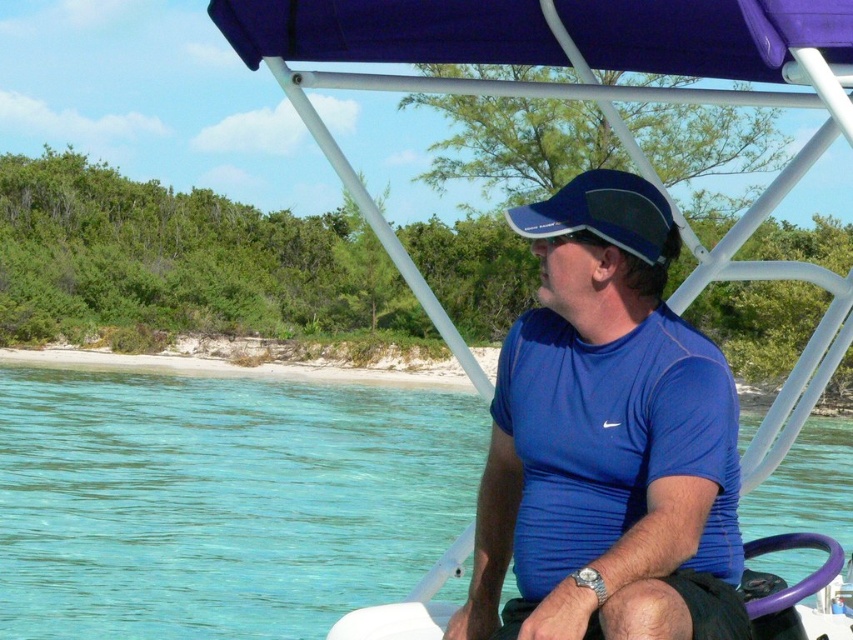
Question: Which object appears closest to the camera in this image?

Choices:
 (A) blue mesh baseball cap at center
 (B) blue mesh shirt at center
 (C) clear blue water at center

Answer: (B)

Question: Is clear blue water at center positioned behind blue mesh baseball cap at center?

Choices:
 (A) no
 (B) yes

Answer: (B)

Question: Observing the image, what is the correct spatial positioning of clear blue water at center in reference to blue mesh shirt at center?

Choices:
 (A) left
 (B) right

Answer: (B)

Question: Can you confirm if clear blue water at center is bigger than blue mesh baseball cap at center?

Choices:
 (A) yes
 (B) no

Answer: (A)

Question: Which object appears closest to the camera in this image?

Choices:
 (A) blue mesh baseball cap at center
 (B) clear blue water at center
 (C) blue mesh shirt at center

Answer: (C)

Question: Among these points, which one is nearest to the camera?

Choices:
 (A) (657, 209)
 (B) (566, 218)

Answer: (A)